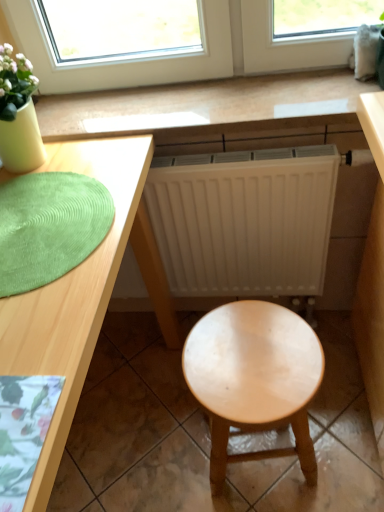
At what (x,y) coordinates should I click in order to perform the action: click on empty space that is ontop of wooden table at center. Please return your answer as a coordinate pair (x, y). Looking at the image, I should click on (180, 98).